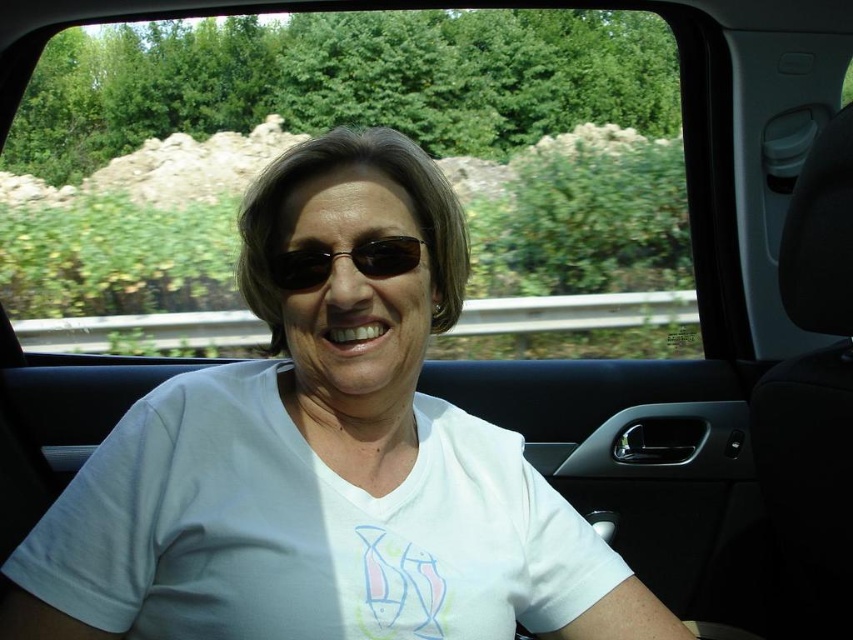
You are a fashion designer observing the scene. You need to determine which item is taller between the white cotton shirt at center and the black plastic sunglasses at center. Which one is taller?

The white cotton shirt at center has a greater height compared to the black plastic sunglasses at center, so the white cotton shirt at center is taller.

You are a passenger in a car and want to check if your white cotton shirt at center is visible from outside the transparent glass car window at center. Can you see it?

The transparent glass car window at center is positioned over the white cotton shirt at center, so yes, the white cotton shirt at center is visible from outside the window.

You are a photographer trying to capture a clear photo of the white cotton shirt at center through the transparent glass car window at center. Considering their heights, will the shirt be fully visible in the photo?

The transparent glass car window at center has a greater height than the white cotton shirt at center, so the shirt will be fully visible in the photo.